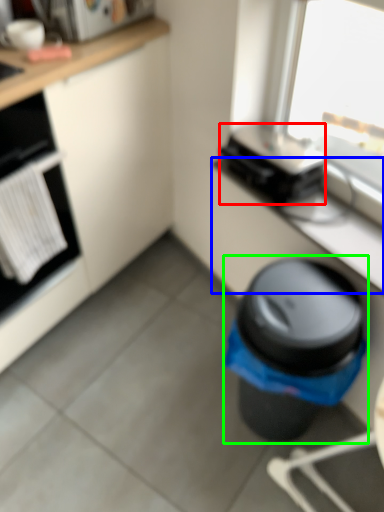
Question: Which object is the closest to the appliance (highlighted by a red box)? Choose among these: counter top (highlighted by a blue box) or waste container (highlighted by a green box).

Choices:
 (A) counter top
 (B) waste container

Answer: (A)